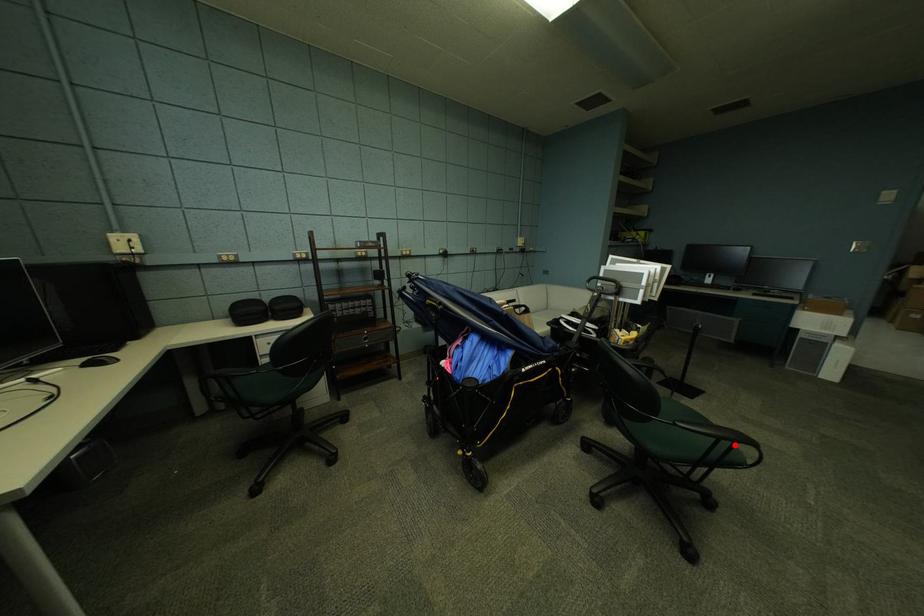
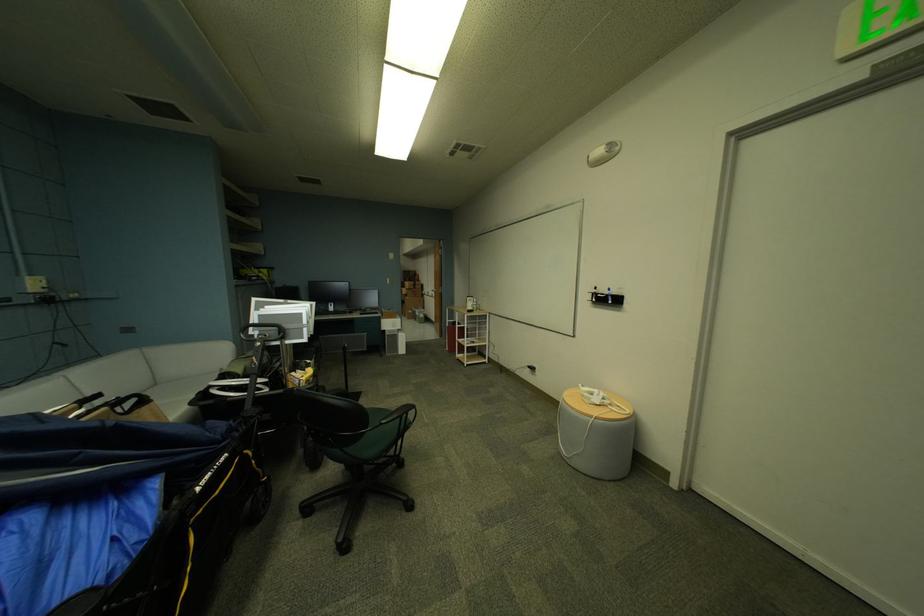
In the second image, find the point that corresponds to the highlighted location in the first image.

(414, 418)